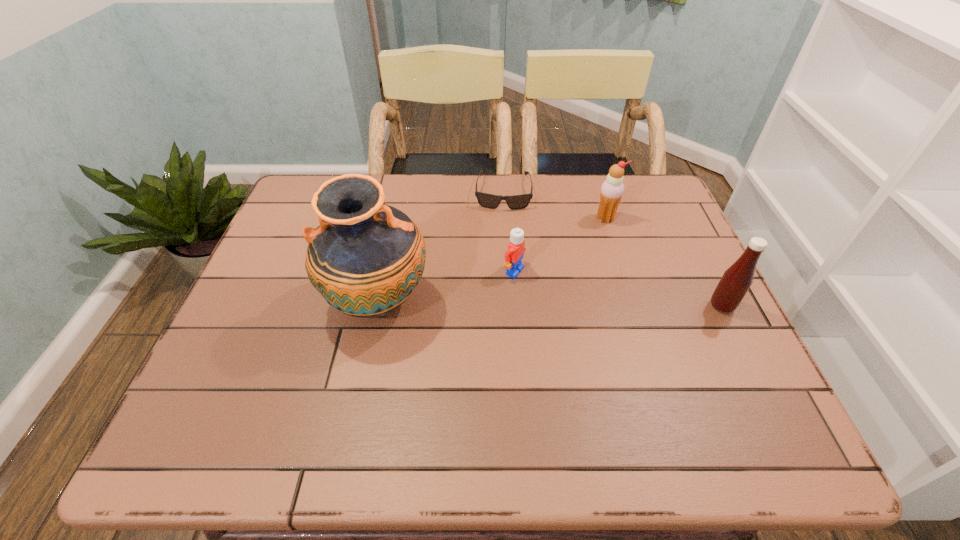
Locate an element on the screen. the tallest object is located at coordinates (366, 258).

Image resolution: width=960 pixels, height=540 pixels. I want to click on the leftmost object, so click(366, 258).

This screenshot has width=960, height=540. Find the location of `the rightmost object`. the rightmost object is located at coordinates (737, 279).

Locate an element on the screen. The height and width of the screenshot is (540, 960). icecream is located at coordinates (612, 189).

The width and height of the screenshot is (960, 540). In order to click on the fourth nearest object in this screenshot , I will do `click(612, 189)`.

Locate an element on the screen. This screenshot has width=960, height=540. the fourth tallest object is located at coordinates (513, 256).

Locate an element on the screen. sunglasses is located at coordinates (486, 200).

The width and height of the screenshot is (960, 540). I want to click on the farthest object, so click(486, 200).

Find the location of a particular element. The width and height of the screenshot is (960, 540). vacant space located 0.100m on the right of the pottery is located at coordinates (472, 301).

Image resolution: width=960 pixels, height=540 pixels. In order to click on vacant space situated on the back of the Tabasco sauce in this screenshot , I will do `click(691, 245)`.